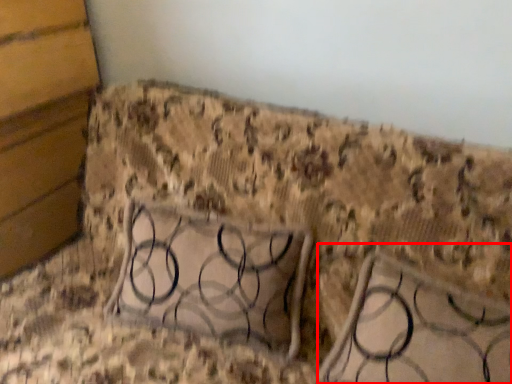
Question: Observing the image, what is the correct spatial positioning of furniture (annotated by the red box) in reference to panel?

Choices:
 (A) right
 (B) left

Answer: (A)